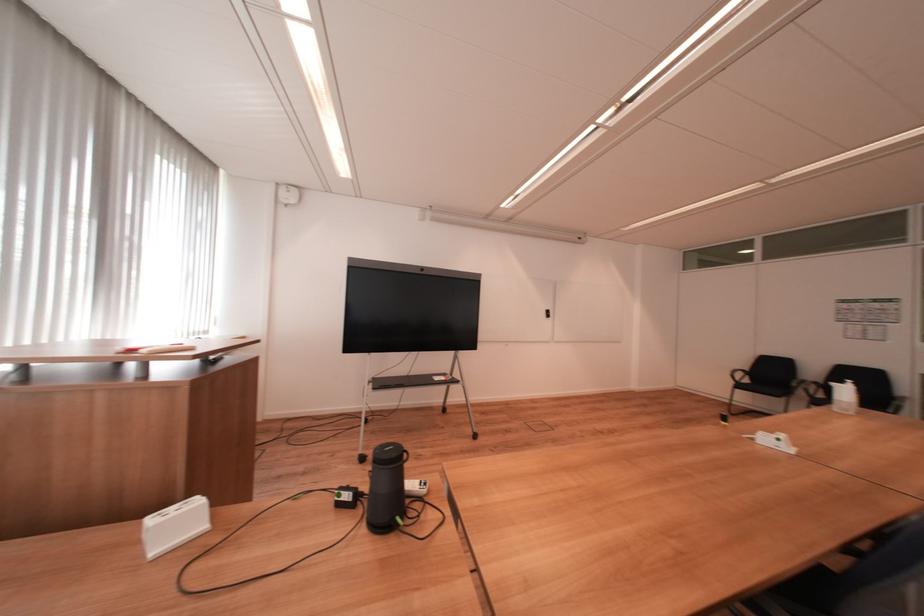
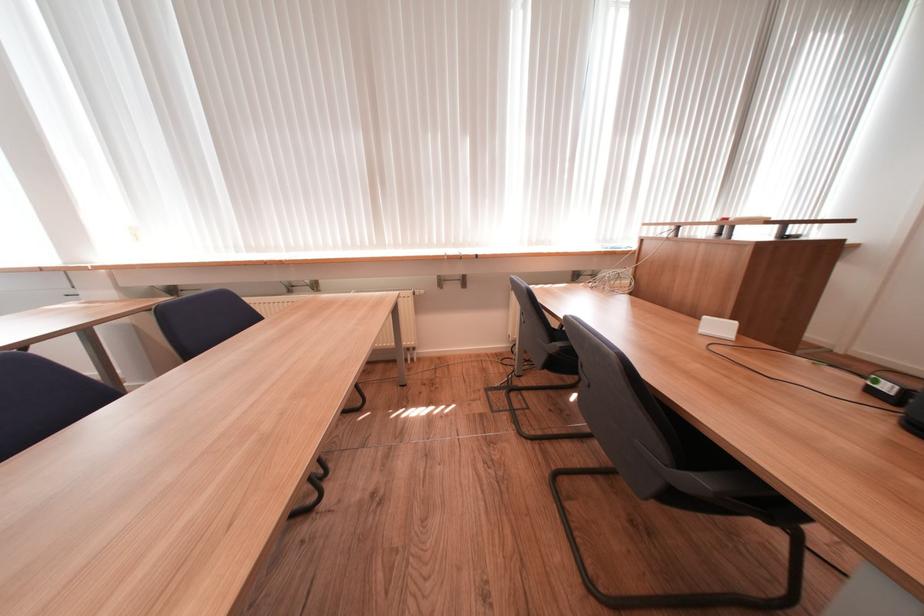
The point at (161,522) is marked in the first image. Where is the corresponding point in the second image?

(713, 320)